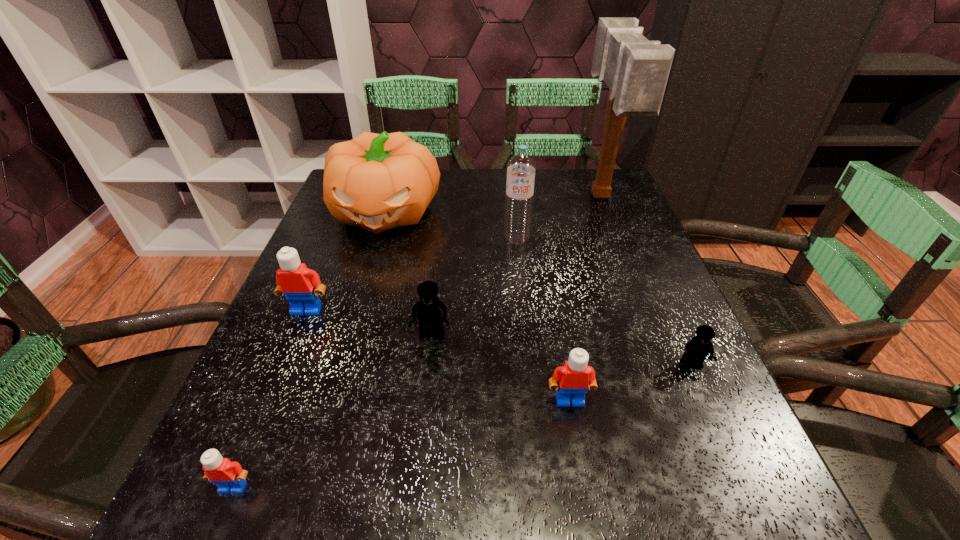
Where is `white Lego that is the closest to the wood mallet`? The width and height of the screenshot is (960, 540). white Lego that is the closest to the wood mallet is located at coordinates (575, 377).